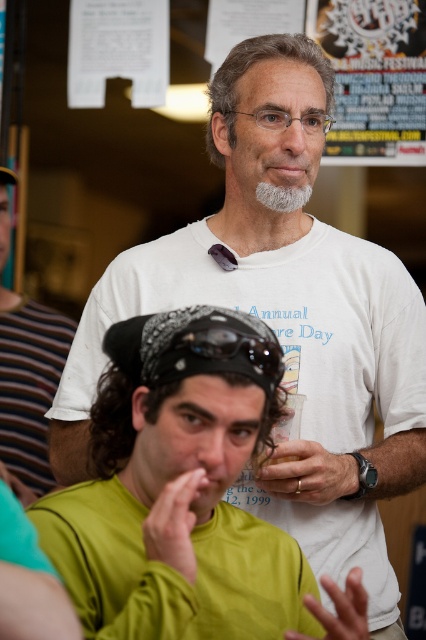
Question: Is green matte shirt at lower center thinner than black textured goggles at center?

Choices:
 (A) no
 (B) yes

Answer: (A)

Question: Where is green matte shirt at center located in relation to green matte shirt at lower center in the image?

Choices:
 (A) below
 (B) above

Answer: (A)

Question: Which object appears closest to the camera in this image?

Choices:
 (A) gray hair at upper center
 (B) gray matte beard at center
 (C) black textured goggles at center

Answer: (C)

Question: In this image, where is green matte shirt at lower center located relative to gray matte beard at center?

Choices:
 (A) below
 (B) above

Answer: (A)

Question: Which point appears closest to the camera in this image?

Choices:
 (A) (219, 632)
 (B) (227, 333)
 (C) (325, 109)

Answer: (A)

Question: Which object is closer to the camera taking this photo?

Choices:
 (A) gray hair at upper center
 (B) black textured goggles at center
 (C) gray matte beard at center
 (D) green matte shirt at center

Answer: (D)